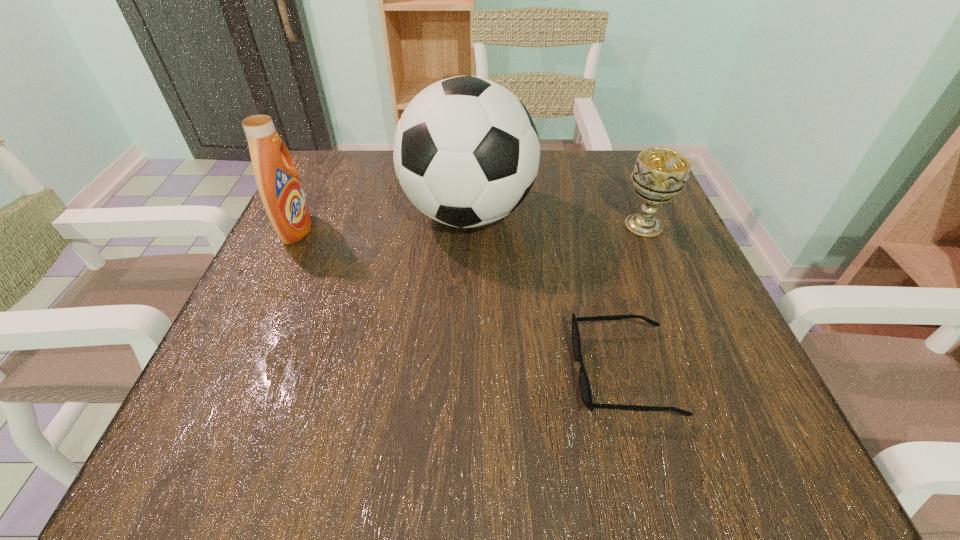
Identify the location of vacant space located on the front-facing side of the shortest object. (387, 372).

At what (x,y) coordinates should I click in order to perform the action: click on vacant space located on the front-facing side of the shortest object. Please return your answer as a coordinate pair (x, y). This screenshot has height=540, width=960. Looking at the image, I should click on (435, 372).

Locate an element on the screen. object situated at the far edge is located at coordinates (466, 152).

Identify the location of object at the near edge. This screenshot has height=540, width=960. (585, 389).

Where is `object located in the left edge section of the desktop`? Image resolution: width=960 pixels, height=540 pixels. object located in the left edge section of the desktop is located at coordinates (277, 179).

Locate an element on the screen. The width and height of the screenshot is (960, 540). chalice located at the right edge is located at coordinates (660, 173).

Locate an element on the screen. The height and width of the screenshot is (540, 960). sunglasses at the right edge is located at coordinates (x=585, y=389).

Find the location of a particular element. This screenshot has width=960, height=540. object that is at the near right corner is located at coordinates (585, 389).

Identify the location of vacant space at the far edge of the desktop. (394, 190).

Where is `free space at the near edge of the desktop`? This screenshot has width=960, height=540. free space at the near edge of the desktop is located at coordinates (581, 427).